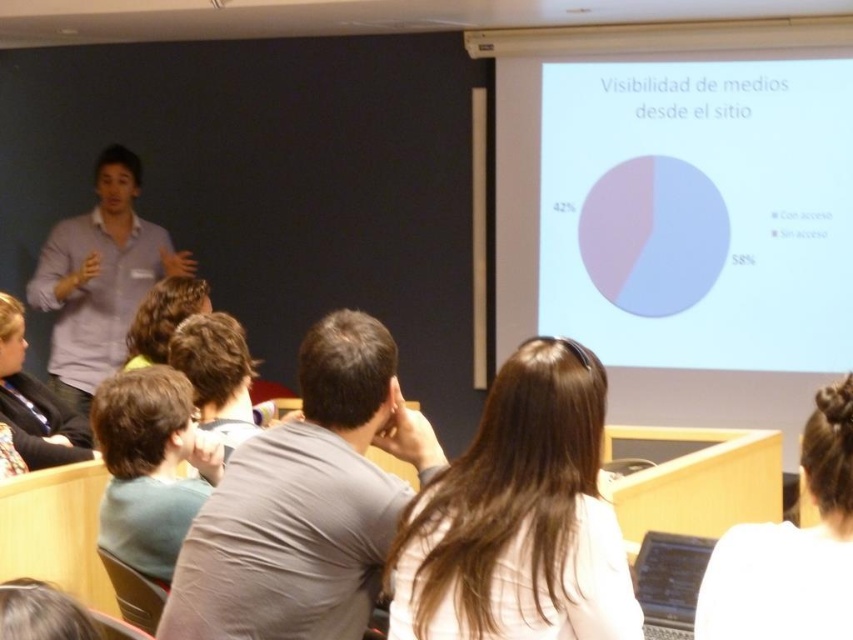
Question: Among these points, which one is nearest to the camera?

Choices:
 (A) (730, 611)
 (B) (534, 604)
 (C) (264, 429)

Answer: (A)

Question: Among these objects, which one is nearest to the camera?

Choices:
 (A) light brown hair at center
 (B) white hair at upper right

Answer: (B)

Question: Among these objects, which one is farthest from the camera?

Choices:
 (A) gray cotton shirt at center
 (B) white hair at upper right
 (C) dark brown hair at center

Answer: (C)

Question: Is gray cotton shirt at center to the right of light blue shirt at left from the viewer's perspective?

Choices:
 (A) yes
 (B) no

Answer: (A)

Question: Does white hair at upper right come behind light blue shirt at left?

Choices:
 (A) yes
 (B) no

Answer: (B)

Question: Does light brown hair at center lie in front of white hair at upper right?

Choices:
 (A) yes
 (B) no

Answer: (B)